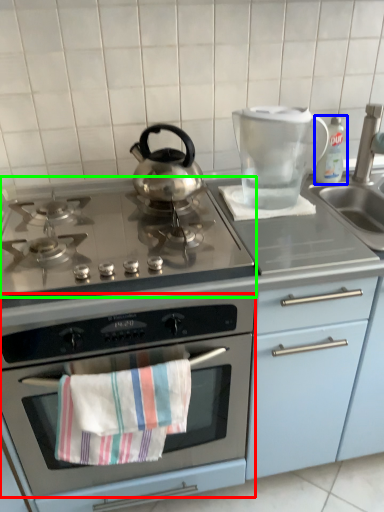
Question: Which object is the farthest from oven (highlighted by a red box)? Choose among these: bottle (highlighted by a blue box) or gas stove (highlighted by a green box).

Choices:
 (A) bottle
 (B) gas stove

Answer: (A)